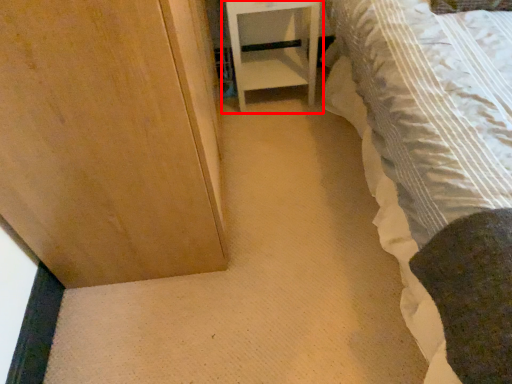
Question: Considering the relative positions of furniture (annotated by the red box) and bed in the image provided, where is furniture (annotated by the red box) located with respect to the staircase?

Choices:
 (A) left
 (B) right

Answer: (A)